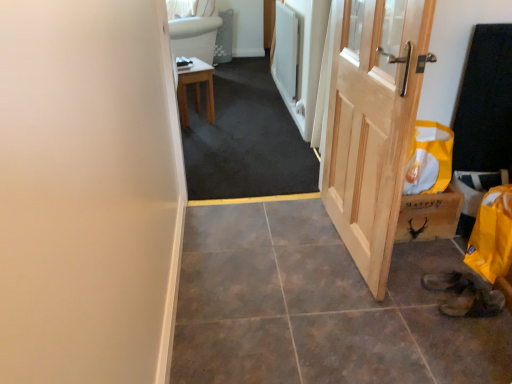
Question: Considering their positions, is dark gray carpet at center located in front of or behind white fabric curtain at upper center?

Choices:
 (A) behind
 (B) front

Answer: (B)

Question: From the image's perspective, relative to white fabric curtain at upper center, is dark gray carpet at center above or below?

Choices:
 (A) above
 (B) below

Answer: (B)

Question: Estimate the real-world distances between objects in this image. Which object is farther from the wooden stool at center?

Choices:
 (A) white fabric curtain at upper center
 (B) natural wood door at right
 (C) dark gray carpet at center
 (D) brown leather shoe at lower right

Answer: (D)

Question: Considering the real-world distances, which object is farthest from the brown leather shoe at lower right?

Choices:
 (A) white fabric curtain at upper center
 (B) natural wood door at right
 (C) wooden stool at center
 (D) dark gray carpet at center

Answer: (A)